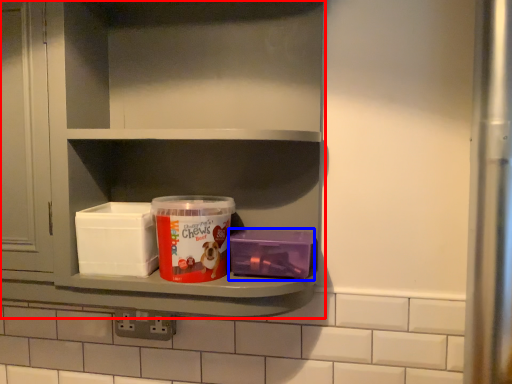
Question: Which object appears farthest to the camera in this image, shelf (highlighted by a red box) or box (highlighted by a blue box)?

Choices:
 (A) shelf
 (B) box

Answer: (B)